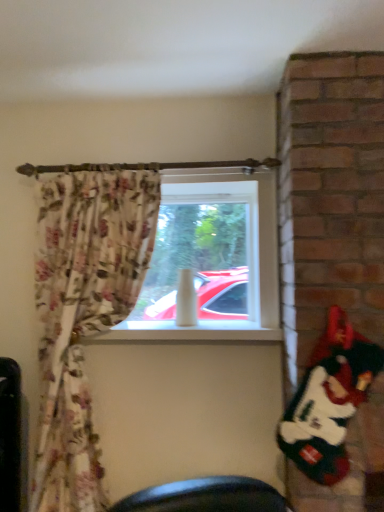
Question: From a real-world perspective, is white plush santa at right physically located above or below transparent glass window at center?

Choices:
 (A) above
 (B) below

Answer: (B)

Question: In terms of width, does white plush santa at right look wider or thinner when compared to transparent glass window at center?

Choices:
 (A) wide
 (B) thin

Answer: (B)

Question: Is point (340, 330) positioned closer to the camera than point (165, 315)?

Choices:
 (A) farther
 (B) closer

Answer: (B)

Question: Is transparent glass window at center bigger or smaller than white plush santa at right?

Choices:
 (A) small
 (B) big

Answer: (B)

Question: In the image, is transparent glass window at center positioned in front of or behind white plush santa at right?

Choices:
 (A) behind
 (B) front

Answer: (A)

Question: From the image's perspective, is transparent glass window at center above or below white plush santa at right?

Choices:
 (A) below
 (B) above

Answer: (B)

Question: From a real-world perspective, is transparent glass window at center physically located above or below white plush santa at right?

Choices:
 (A) below
 (B) above

Answer: (B)